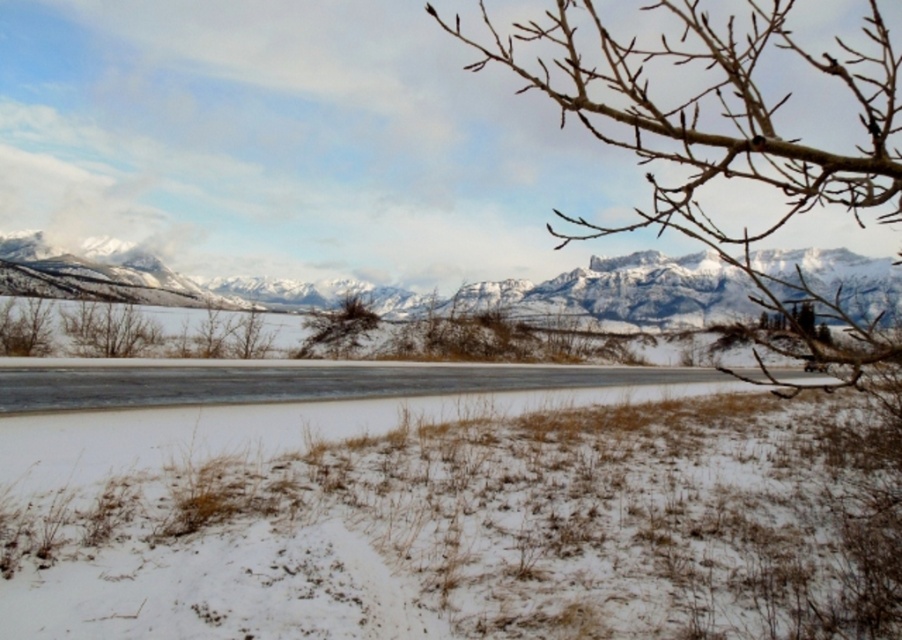
Is smooth ice at center taller than brown textured bush at center?

In fact, smooth ice at center may be shorter than brown textured bush at center.

Is point (371, 364) farther from camera compared to point (357, 332)?

No.

Image resolution: width=902 pixels, height=640 pixels. What are the coordinates of `smooth ice at center` in the screenshot? It's located at (296, 381).

Does smooth ice at center have a greater height compared to brown leafless branch at lower left?

In fact, smooth ice at center may be shorter than brown leafless branch at lower left.

Between point (100, 376) and point (32, 337), which one is positioned behind?

The point (32, 337) is more distant.

Where is `smooth ice at center`? The width and height of the screenshot is (902, 640). smooth ice at center is located at coordinates (296, 381).

Does point (212, 611) come in front of point (2, 371)?

Yes, point (212, 611) is in front of point (2, 371).

Between point (186, 528) and point (0, 412), which one is positioned in front?

Positioned in front is point (186, 528).

Locate an element on the screen. The height and width of the screenshot is (640, 902). white snow at center is located at coordinates (459, 518).